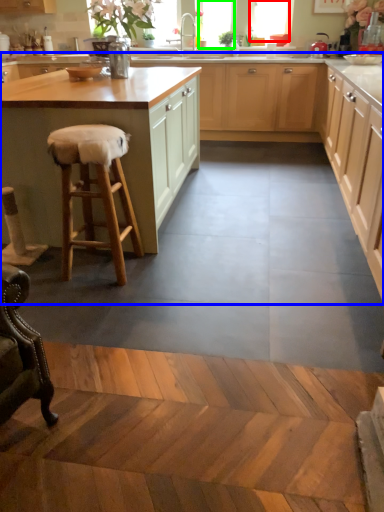
Question: Based on their relative distances, which object is nearer to window (highlighted by a red box)? Choose from cabinetry (highlighted by a blue box) and window screen (highlighted by a green box).

Choices:
 (A) cabinetry
 (B) window screen

Answer: (B)